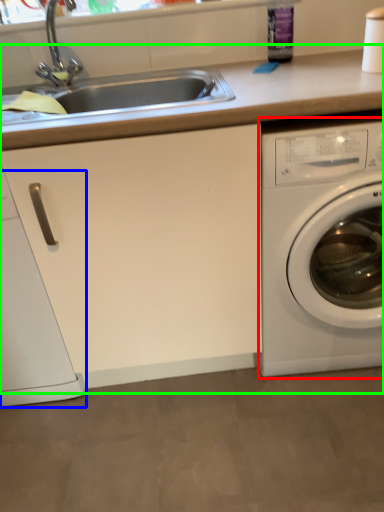
Question: Estimate the real-world distances between objects in this image. Which object is closer to washing machine (highlighted by a red box), dish washer (highlighted by a blue box) or counter top (highlighted by a green box)?

Choices:
 (A) dish washer
 (B) counter top

Answer: (B)